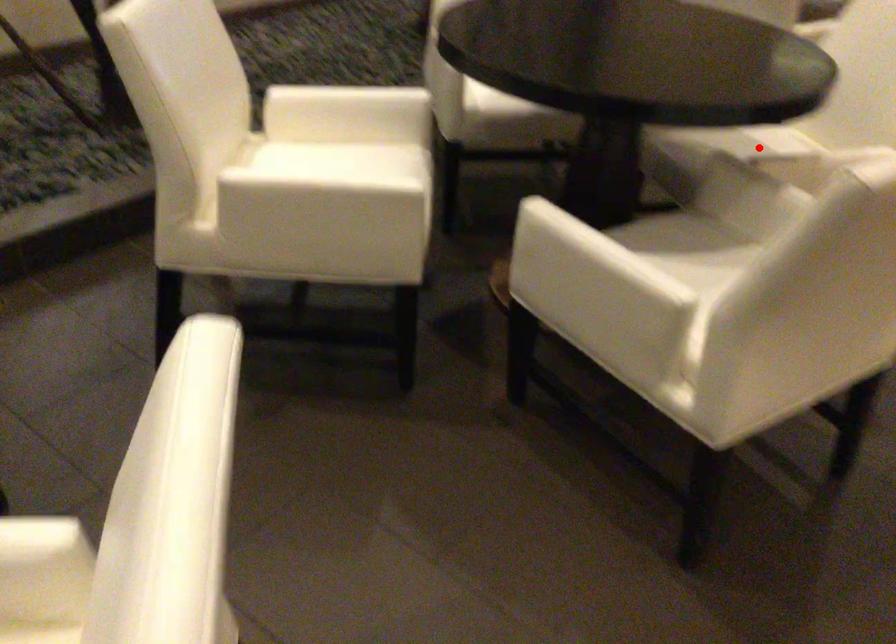
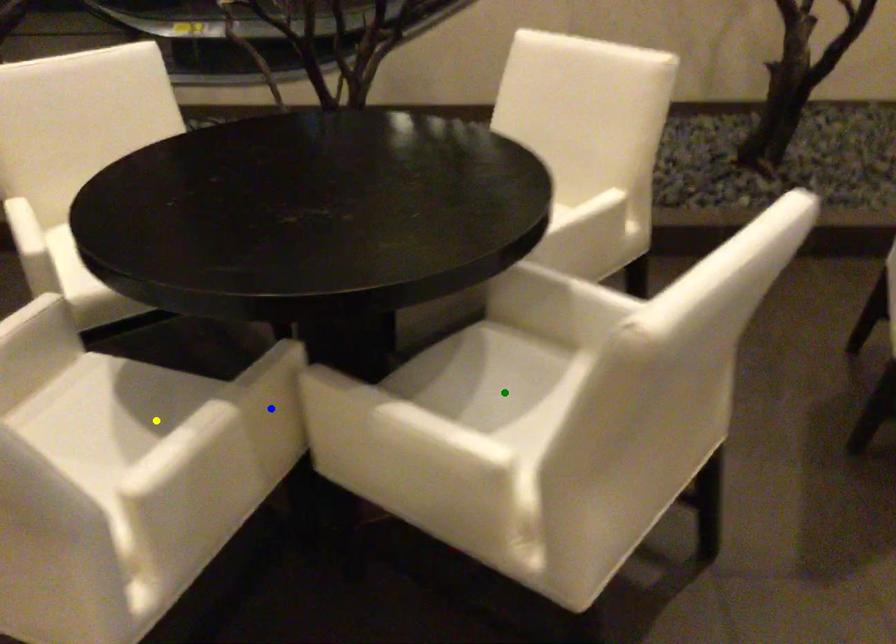
Question: I am providing you with two images of the same scene from different viewpoints. A red point is marked on the first image. You are given multiple points on the second image. In image 2, which mark is for the same physical point as the one in image 1?

Choices:
 (A) yellow point
 (B) green point
 (C) blue point

Answer: (B)